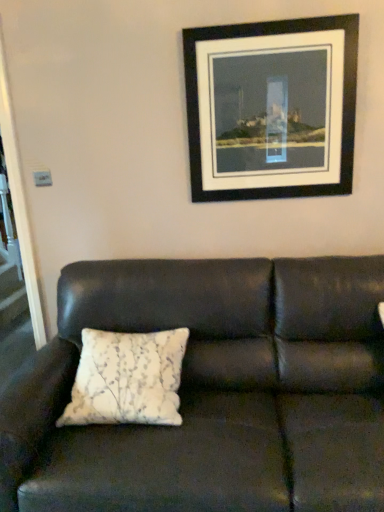
Question: Considering the relative sizes of white textured pillow at center and black matte picture frame at upper center in the image provided, is white textured pillow at center smaller than black matte picture frame at upper center?

Choices:
 (A) no
 (B) yes

Answer: (A)

Question: Is white textured pillow at center to the right of black matte picture frame at upper center from the viewer's perspective?

Choices:
 (A) yes
 (B) no

Answer: (B)

Question: Is white textured pillow at center turned away from black matte picture frame at upper center?

Choices:
 (A) no
 (B) yes

Answer: (A)

Question: From a real-world perspective, is white textured pillow at center beneath black matte picture frame at upper center?

Choices:
 (A) yes
 (B) no

Answer: (A)

Question: Is white textured pillow at center in contact with black matte picture frame at upper center?

Choices:
 (A) yes
 (B) no

Answer: (B)

Question: From the image's perspective, is white textured pillow at center on black matte picture frame at upper center?

Choices:
 (A) yes
 (B) no

Answer: (B)

Question: From a real-world perspective, is leather couch at center positioned under black matte picture frame at upper center based on gravity?

Choices:
 (A) no
 (B) yes

Answer: (B)

Question: From the image's perspective, does leather couch at center appear higher than black matte picture frame at upper center?

Choices:
 (A) no
 (B) yes

Answer: (A)

Question: Is black matte picture frame at upper center at the back of leather couch at center?

Choices:
 (A) yes
 (B) no

Answer: (B)

Question: Is leather couch at center thinner than black matte picture frame at upper center?

Choices:
 (A) yes
 (B) no

Answer: (B)

Question: Would you say black matte picture frame at upper center is part of leather couch at center's contents?

Choices:
 (A) no
 (B) yes

Answer: (A)

Question: Does leather couch at center have a lesser height compared to black matte picture frame at upper center?

Choices:
 (A) no
 (B) yes

Answer: (A)

Question: Is white textured pillow at center at the left side of leather couch at center?

Choices:
 (A) yes
 (B) no

Answer: (A)